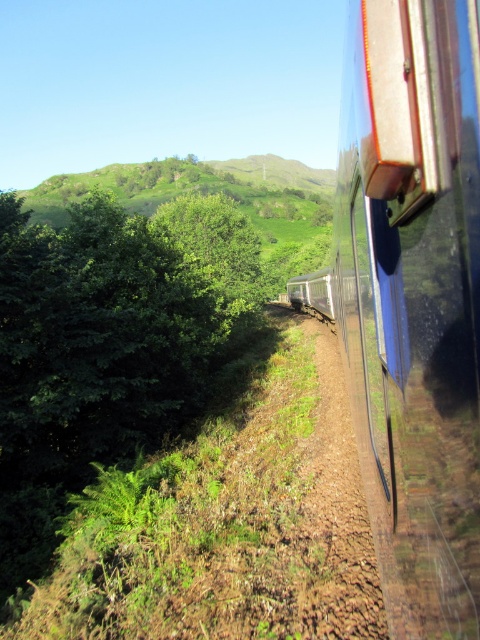
You are standing on the train platform and want to board the glossy metallic train at right. The platform has a safety line marked 30 inches away from the edge. Can you safely approach the edge to board the train?

The glossy metallic train at right is 32.99 inches away from the viewer. Since the safety line is 30 inches away from the edge, you can approach up to the safety line, but the distance between you and the train is still 2.99 inches beyond the safety limit. Therefore, it is not safe to proceed closer than the marked line to board the train.

You are inside the train and looking through the window. There are two points marked on the window at coordinates point [479,499] and point [336,586]. Which point is closer to you?

Point [479,499] is closer to the camera than point [336,586].